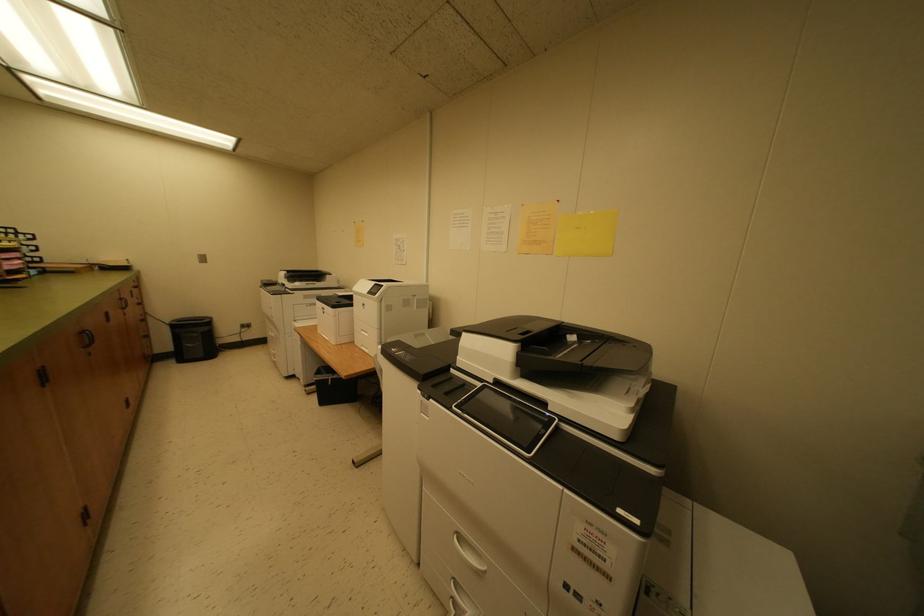
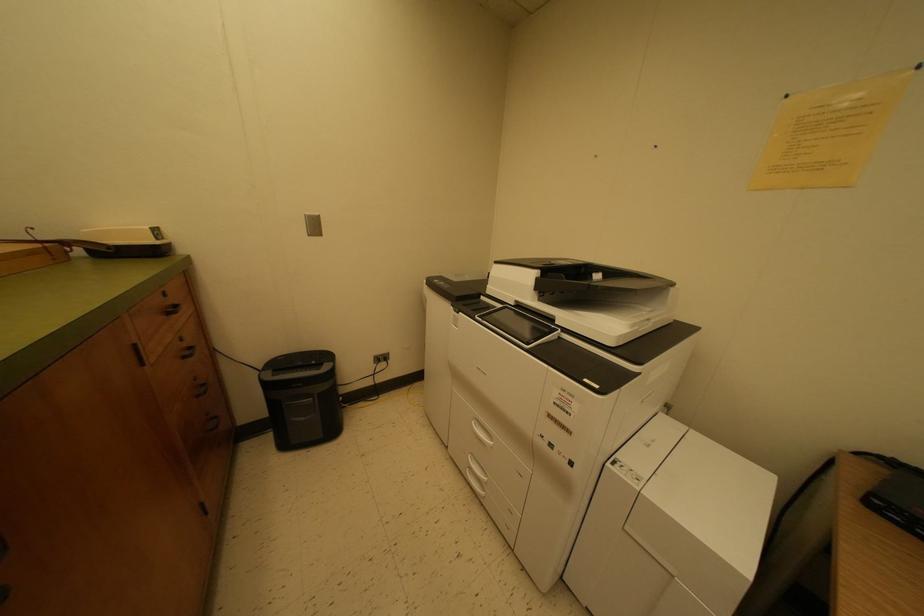
What movement of the cameraman would produce the second image?

The cameraman moved toward left, forward.